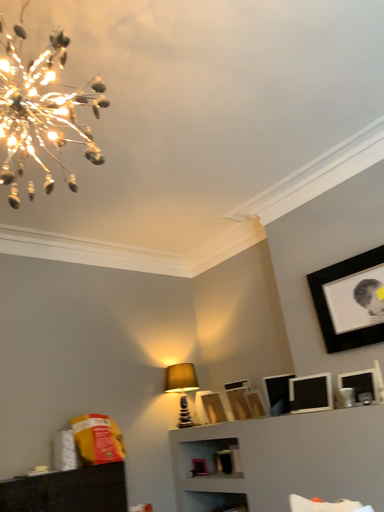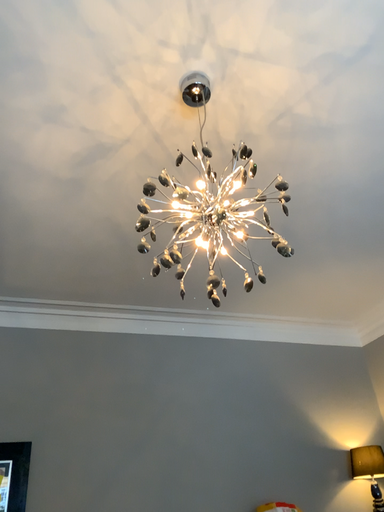
Question: Which way did the camera rotate in the video?

Choices:
 (A) rotated left
 (B) rotated right

Answer: (A)